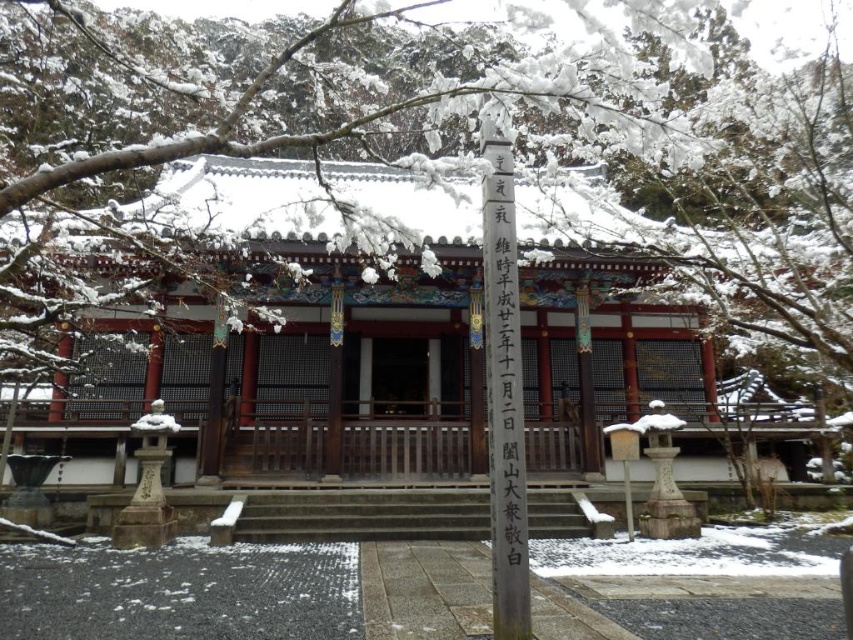
Does black stone pole at center come in front of black wood signpost at center?

That is True.

Who is lower down, black stone pole at center or black wood signpost at center?

black wood signpost at center is below.

You are a GUI agent. You are given a task and a screenshot of the screen. Output one action in this format:
    pyautogui.click(x=<x>, y=<y>)
    Task: Click on the black stone pole at center
    
    Given the screenshot: What is the action you would take?
    pyautogui.click(x=503, y=394)